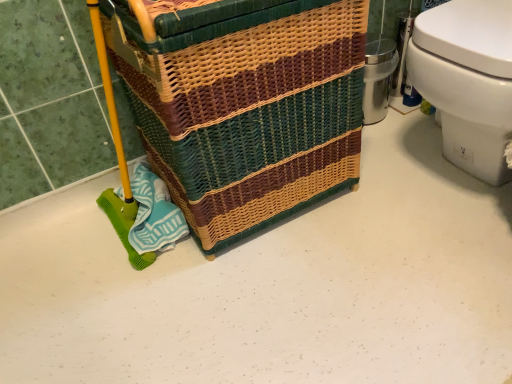
Question: From their relative heights in the image, would you say white glossy toilet at right is taller or shorter than woven wicker basket at center?

Choices:
 (A) tall
 (B) short

Answer: (B)

Question: Relative to woven wicker basket at center, is white glossy toilet at right in front or behind?

Choices:
 (A) behind
 (B) front

Answer: (A)

Question: Is point (443, 125) closer or farther from the camera than point (186, 177)?

Choices:
 (A) closer
 (B) farther

Answer: (B)

Question: From the image's perspective, relative to white glossy toilet at right, is woven wicker basket at center above or below?

Choices:
 (A) above
 (B) below

Answer: (B)

Question: In the image, is woven wicker basket at center on the left side or the right side of white glossy toilet at right?

Choices:
 (A) left
 (B) right

Answer: (A)

Question: From a real-world perspective, is woven wicker basket at center positioned above or below white glossy toilet at right?

Choices:
 (A) below
 (B) above

Answer: (B)

Question: Is woven wicker basket at center inside or outside of white glossy toilet at right?

Choices:
 (A) outside
 (B) inside

Answer: (A)